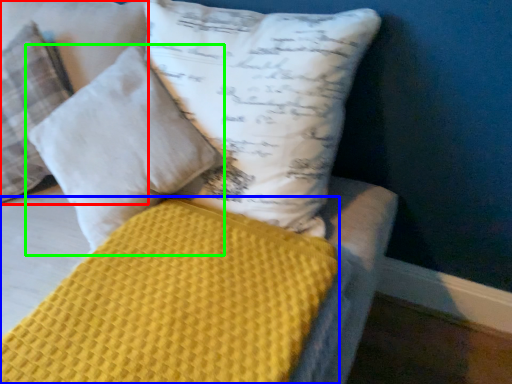
Question: Which is nearer to the pillow (highlighted by a red box)? mattress (highlighted by a blue box) or pillow (highlighted by a green box).

Choices:
 (A) mattress
 (B) pillow

Answer: (B)